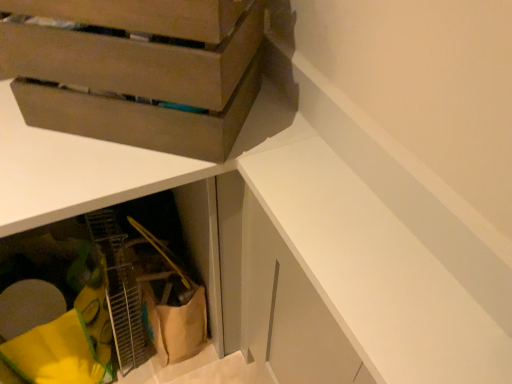
The width and height of the screenshot is (512, 384). I want to click on matte brown cardboard box at upper left, so click(x=138, y=85).

Which is behind, point (308, 256) or point (20, 278)?

The point (20, 278) is behind.

Where is `cabinetry above the yellow fabric at lower left, which appears as the 2th cabinetry when viewed from the front (from a real-world perspective)`? Image resolution: width=512 pixels, height=384 pixels. cabinetry above the yellow fabric at lower left, which appears as the 2th cabinetry when viewed from the front (from a real-world perspective) is located at coordinates (375, 272).

Is the surface of white matte cabinet at upper right, acting as the first cabinetry starting from the front, in direct contact with yellow fabric at lower left, the 1th cabinetry positioned from the back?

No, white matte cabinet at upper right, acting as the first cabinetry starting from the front, is not beside yellow fabric at lower left, the 1th cabinetry positioned from the back.

Between point (140, 207) and point (238, 33), which one is positioned in front?

The point (238, 33) is in front.

From the image's perspective, is yellow fabric at lower left, which appears as the 2th cabinetry when viewed from the front, located beneath matte brown cardboard box at upper left?

Correct, yellow fabric at lower left, which appears as the 2th cabinetry when viewed from the front, appears lower than matte brown cardboard box at upper left in the image.

Considering the relative sizes of yellow fabric at lower left, which appears as the 2th cabinetry when viewed from the front, and matte brown cardboard box at upper left in the image provided, is yellow fabric at lower left, which appears as the 2th cabinetry when viewed from the front, bigger than matte brown cardboard box at upper left?

Indeed, yellow fabric at lower left, which appears as the 2th cabinetry when viewed from the front, has a larger size compared to matte brown cardboard box at upper left.

Is matte brown cardboard box at upper left smaller than yellow fabric at lower left, the 1th cabinetry positioned from the back?

Indeed, matte brown cardboard box at upper left has a smaller size compared to yellow fabric at lower left, the 1th cabinetry positioned from the back.

Is matte brown cardboard box at upper left located outside yellow fabric at lower left, acting as the 2th cabinetry starting from the right?

matte brown cardboard box at upper left lies outside yellow fabric at lower left, acting as the 2th cabinetry starting from the right,'s area.

From a real-world perspective, does matte brown cardboard box at upper left stand above yellow fabric at lower left, which appears as the 2th cabinetry when viewed from the front?

Yes, from a real-world perspective, matte brown cardboard box at upper left is above yellow fabric at lower left, which appears as the 2th cabinetry when viewed from the front.

Considering the sizes of objects matte brown cardboard box at upper left and yellow fabric at lower left, which appears as the 2th cabinetry when viewed from the front, in the image provided, who is shorter, matte brown cardboard box at upper left or yellow fabric at lower left, which appears as the 2th cabinetry when viewed from the front,?

Standing shorter between the two is matte brown cardboard box at upper left.

Considering the positions of objects matte brown cardboard box at upper left and white matte cabinet at upper right, arranged as the 2th cabinetry when viewed from the back, in the image provided, who is more to the left, matte brown cardboard box at upper left or white matte cabinet at upper right, arranged as the 2th cabinetry when viewed from the back,?

Result: matte brown cardboard box at upper left is more to the left.

From the picture: Considering the sizes of objects matte brown cardboard box at upper left and white matte cabinet at upper right, acting as the first cabinetry starting from the front, in the image provided, who is bigger, matte brown cardboard box at upper left or white matte cabinet at upper right, acting as the first cabinetry starting from the front,?

matte brown cardboard box at upper left is bigger.

From the image's perspective, does matte brown cardboard box at upper left appear lower than white matte cabinet at upper right, arranged as the 2th cabinetry when viewed from the back?

Incorrect, from the image's perspective, matte brown cardboard box at upper left is higher than white matte cabinet at upper right, arranged as the 2th cabinetry when viewed from the back.

Is matte brown cardboard box at upper left thinner than white matte cabinet at upper right, which is the 2th cabinetry from left to right?

No, matte brown cardboard box at upper left is not thinner than white matte cabinet at upper right, which is the 2th cabinetry from left to right.

From the image's perspective, between yellow fabric at lower left, the 1th cabinetry positioned from the back, and white matte cabinet at upper right, acting as the first cabinetry starting from the front, who is located below?

yellow fabric at lower left, the 1th cabinetry positioned from the back, from the image's perspective.

Considering the relative positions of yellow fabric at lower left, acting as the 2th cabinetry starting from the right, and white matte cabinet at upper right, arranged as the 2th cabinetry when viewed from the back, in the image provided, is yellow fabric at lower left, acting as the 2th cabinetry starting from the right, to the right of white matte cabinet at upper right, arranged as the 2th cabinetry when viewed from the back, from the viewer's perspective?

No.

Is yellow fabric at lower left, which appears as the 2th cabinetry when viewed from the front, outside of white matte cabinet at upper right, which is the 2th cabinetry from left to right?

yellow fabric at lower left, which appears as the 2th cabinetry when viewed from the front, is positioned outside white matte cabinet at upper right, which is the 2th cabinetry from left to right.

Is yellow fabric at lower left, which appears as the 2th cabinetry when viewed from the front, behind white matte cabinet at upper right, which is the 2th cabinetry from left to right?

That is True.

In terms of width, does white matte cabinet at upper right, marked as the 1th cabinetry in a right-to-left arrangement, look wider or thinner when compared to matte brown cardboard box at upper left?

Considering their sizes, white matte cabinet at upper right, marked as the 1th cabinetry in a right-to-left arrangement, looks slimmer than matte brown cardboard box at upper left.

From the image's perspective, is white matte cabinet at upper right, which is the 2th cabinetry from left to right, located above or below matte brown cardboard box at upper left?

From the image's perspective, white matte cabinet at upper right, which is the 2th cabinetry from left to right, appears below matte brown cardboard box at upper left.

Is white matte cabinet at upper right, marked as the 1th cabinetry in a right-to-left arrangement, looking in the opposite direction of matte brown cardboard box at upper left?

white matte cabinet at upper right, marked as the 1th cabinetry in a right-to-left arrangement, is not turned away from matte brown cardboard box at upper left.

Is white matte cabinet at upper right, which is the 2th cabinetry from left to right, spatially inside matte brown cardboard box at upper left, or outside of it?

The correct answer is: outside.

Identify the location of cabinetry located on the right of yellow fabric at lower left, acting as the 2th cabinetry starting from the right. (375, 272).

Where is `cabinetry behind the matte brown cardboard box at upper left`? The width and height of the screenshot is (512, 384). cabinetry behind the matte brown cardboard box at upper left is located at coordinates 111,286.

From the picture: Looking at the image, which one is located further to matte brown cardboard box at upper left, white matte cabinet at upper right, which is the 2th cabinetry from left to right, or yellow fabric at lower left, the 1th cabinetry positioned from the back?

Based on the image, yellow fabric at lower left, the 1th cabinetry positioned from the back, appears to be further to matte brown cardboard box at upper left.

Based on their spatial positions, is yellow fabric at lower left, which appears as the 2th cabinetry when viewed from the front, or matte brown cardboard box at upper left further from white matte cabinet at upper right, arranged as the 2th cabinetry when viewed from the back?

yellow fabric at lower left, which appears as the 2th cabinetry when viewed from the front, lies further to white matte cabinet at upper right, arranged as the 2th cabinetry when viewed from the back, than the other object.

Based on the photo, when comparing their distances from yellow fabric at lower left, the 1th cabinetry positioned from the back, does white matte cabinet at upper right, which is the 2th cabinetry from left to right, or matte brown cardboard box at upper left seem further?

Among the two, white matte cabinet at upper right, which is the 2th cabinetry from left to right, is located further to yellow fabric at lower left, the 1th cabinetry positioned from the back.

Looking at the image, which one is located further to white matte cabinet at upper right, arranged as the 2th cabinetry when viewed from the back, matte brown cardboard box at upper left or yellow fabric at lower left, the 1th cabinetry positioned from the back?

yellow fabric at lower left, the 1th cabinetry positioned from the back, is further to white matte cabinet at upper right, arranged as the 2th cabinetry when viewed from the back.

From the picture: Considering their positions, is matte brown cardboard box at upper left positioned further to yellow fabric at lower left, positioned as the 1th cabinetry in left-to-right order, than white matte cabinet at upper right, which is the 2th cabinetry from left to right?

white matte cabinet at upper right, which is the 2th cabinetry from left to right, is positioned further to the anchor yellow fabric at lower left, positioned as the 1th cabinetry in left-to-right order.

When comparing their distances from matte brown cardboard box at upper left, does yellow fabric at lower left, which appears as the 2th cabinetry when viewed from the front, or white matte cabinet at upper right, which is the 2th cabinetry from left to right, seem further?

yellow fabric at lower left, which appears as the 2th cabinetry when viewed from the front, is positioned further to the anchor matte brown cardboard box at upper left.

Where is `cardboard box situated between yellow fabric at lower left, positioned as the 1th cabinetry in left-to-right order, and white matte cabinet at upper right, marked as the 1th cabinetry in a right-to-left arrangement, from left to right`? cardboard box situated between yellow fabric at lower left, positioned as the 1th cabinetry in left-to-right order, and white matte cabinet at upper right, marked as the 1th cabinetry in a right-to-left arrangement, from left to right is located at coordinates (138, 85).